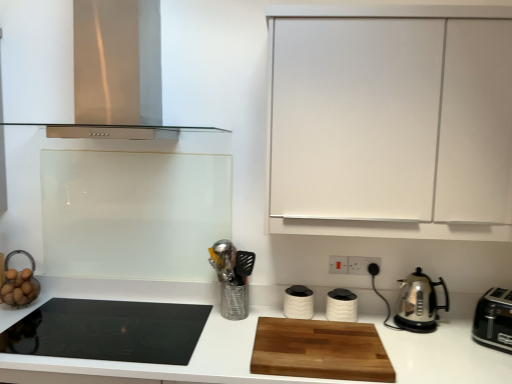
Question: From the image's perspective, does polished stainless steel kettle at right, positioned as the second kitchen appliance in right-to-left order, appear lower than wooden cutting board at center?

Choices:
 (A) no
 (B) yes

Answer: (A)

Question: Is polished stainless steel kettle at right, positioned as the second kitchen appliance in right-to-left order, looking in the opposite direction of wooden cutting board at center?

Choices:
 (A) no
 (B) yes

Answer: (A)

Question: From a real-world perspective, is polished stainless steel kettle at right, positioned as the second kitchen appliance in right-to-left order, over wooden cutting board at center?

Choices:
 (A) yes
 (B) no

Answer: (A)

Question: Considering the relative sizes of polished stainless steel kettle at right, positioned as the second kitchen appliance in right-to-left order, and wooden cutting board at center in the image provided, is polished stainless steel kettle at right, positioned as the second kitchen appliance in right-to-left order, taller than wooden cutting board at center?

Choices:
 (A) yes
 (B) no

Answer: (B)

Question: Is polished stainless steel kettle at right, positioned as the second kitchen appliance in right-to-left order, not near wooden cutting board at center?

Choices:
 (A) no
 (B) yes

Answer: (A)

Question: Is black plastic electric outlet at center-right, which is the 3th electric outlet from left to right, to the left or to the right of white plastic electric outlet at center-right, acting as the first electric outlet starting from the left, in the image?

Choices:
 (A) left
 (B) right

Answer: (B)

Question: Considering the positions of black plastic electric outlet at center-right, which is the 3th electric outlet from left to right, and white plastic electric outlet at center-right, acting as the first electric outlet starting from the left, in the image, is black plastic electric outlet at center-right, which is the 3th electric outlet from left to right, bigger or smaller than white plastic electric outlet at center-right, acting as the first electric outlet starting from the left,?

Choices:
 (A) big
 (B) small

Answer: (B)

Question: In terms of width, does black plastic electric outlet at center-right, arranged as the 1th electric outlet when viewed from the right, look wider or thinner when compared to white plastic electric outlet at center-right, acting as the third electric outlet starting from the right?

Choices:
 (A) wide
 (B) thin

Answer: (A)

Question: From a real-world perspective, is black plastic electric outlet at center-right, which is the 3th electric outlet from left to right, positioned above or below white plastic electric outlet at center-right, acting as the first electric outlet starting from the left?

Choices:
 (A) below
 (B) above

Answer: (A)

Question: Is polished stainless steel kettle at right, which is the 3th kitchen appliance in left-to-right order, in front of or behind white matte canisters at center, the third kitchen appliance from the right, in the image?

Choices:
 (A) front
 (B) behind

Answer: (A)

Question: From the image's perspective, is polished stainless steel kettle at right, which is the 3th kitchen appliance in left-to-right order, above or below white matte canisters at center, the third kitchen appliance from the right?

Choices:
 (A) below
 (B) above

Answer: (B)

Question: Based on their positions, is polished stainless steel kettle at right, which is the 3th kitchen appliance in left-to-right order, located to the left or right of white matte canisters at center, the third kitchen appliance from the right?

Choices:
 (A) right
 (B) left

Answer: (A)

Question: Is polished stainless steel kettle at right, which is the 3th kitchen appliance in left-to-right order, spatially inside white matte canisters at center, the second kitchen appliance when ordered from left to right, or outside of it?

Choices:
 (A) inside
 (B) outside

Answer: (B)

Question: From a real-world perspective, is stainless steel range hood at upper left above or below wooden cutting board at center?

Choices:
 (A) above
 (B) below

Answer: (A)

Question: Considering the relative positions of stainless steel range hood at upper left and wooden cutting board at center in the image provided, is stainless steel range hood at upper left to the left or to the right of wooden cutting board at center?

Choices:
 (A) right
 (B) left

Answer: (B)